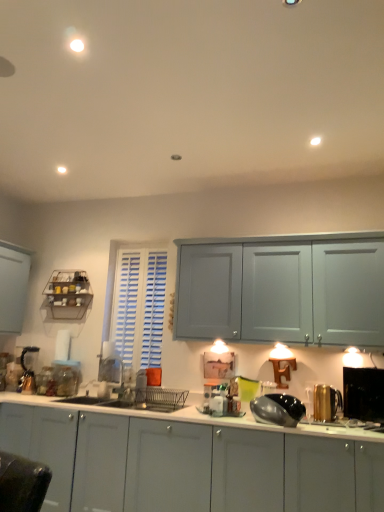
Question: Can you confirm if clear glass jar at lower left, marked as the second appliance in a left-to-right arrangement, is positioned to the left of shiny metallic kettle at center, the 3th appliance in the right-to-left sequence?

Choices:
 (A) no
 (B) yes

Answer: (B)

Question: Is clear glass jar at lower left, marked as the second appliance in a left-to-right arrangement, aimed at shiny metallic kettle at center, marked as the fifth appliance in a back-to-front arrangement?

Choices:
 (A) yes
 (B) no

Answer: (B)

Question: Can you confirm if clear glass jar at lower left, the 4th appliance in the front-to-back sequence, is shorter than shiny metallic kettle at center, marked as the fifth appliance in a back-to-front arrangement?

Choices:
 (A) yes
 (B) no

Answer: (B)

Question: Is clear glass jar at lower left, the second appliance viewed from the back, oriented away from shiny metallic kettle at center, marked as the first appliance in a front-to-back arrangement?

Choices:
 (A) no
 (B) yes

Answer: (A)

Question: From a real-world perspective, is clear glass jar at lower left, marked as the second appliance in a left-to-right arrangement, located higher than shiny metallic kettle at center, the 3th appliance in the left-to-right sequence?

Choices:
 (A) no
 (B) yes

Answer: (B)

Question: From their relative heights in the image, would you say shiny metallic kettle at center, the 3th appliance in the left-to-right sequence, is taller or shorter than clear glass jar at lower left, which is counted as the 4th appliance, starting from the right?

Choices:
 (A) tall
 (B) short

Answer: (B)

Question: Considering the positions of point (284, 401) and point (71, 364), is point (284, 401) closer or farther from the camera than point (71, 364)?

Choices:
 (A) farther
 (B) closer

Answer: (B)

Question: From a real-world perspective, is shiny metallic kettle at center, marked as the first appliance in a front-to-back arrangement, positioned above or below clear glass jar at lower left, the second appliance viewed from the back?

Choices:
 (A) above
 (B) below

Answer: (B)

Question: In terms of size, does shiny metallic kettle at center, marked as the first appliance in a front-to-back arrangement, appear bigger or smaller than clear glass jar at lower left, the 4th appliance in the front-to-back sequence?

Choices:
 (A) small
 (B) big

Answer: (B)

Question: Visually, is shiny metallic kettle at center, the 3th appliance in the right-to-left sequence, positioned to the left or to the right of black glossy toaster at right, arranged as the 1th appliance when viewed from the right?

Choices:
 (A) right
 (B) left

Answer: (B)

Question: Based on their sizes in the image, would you say shiny metallic kettle at center, the 3th appliance in the left-to-right sequence, is bigger or smaller than black glossy toaster at right, arranged as the 1th appliance when viewed from the right?

Choices:
 (A) small
 (B) big

Answer: (B)

Question: In terms of height, does shiny metallic kettle at center, marked as the fifth appliance in a back-to-front arrangement, look taller or shorter compared to black glossy toaster at right, which is counted as the fifth appliance, starting from the left?

Choices:
 (A) short
 (B) tall

Answer: (A)

Question: Considering the positions of shiny metallic kettle at center, the 3th appliance in the left-to-right sequence, and black glossy toaster at right, positioned as the 2th appliance in front-to-back order, in the image, is shiny metallic kettle at center, the 3th appliance in the left-to-right sequence, wider or thinner than black glossy toaster at right, positioned as the 2th appliance in front-to-back order,?

Choices:
 (A) thin
 (B) wide

Answer: (B)

Question: Do you think black glossy toaster at right, which is counted as the fifth appliance, starting from the left, is within clear glass jar at lower left, which is counted as the 4th appliance, starting from the right, or outside of it?

Choices:
 (A) inside
 (B) outside

Answer: (B)

Question: Is black glossy toaster at right, positioned as the 2th appliance in front-to-back order, wider or thinner than clear glass jar at lower left, the 4th appliance in the front-to-back sequence?

Choices:
 (A) thin
 (B) wide

Answer: (A)